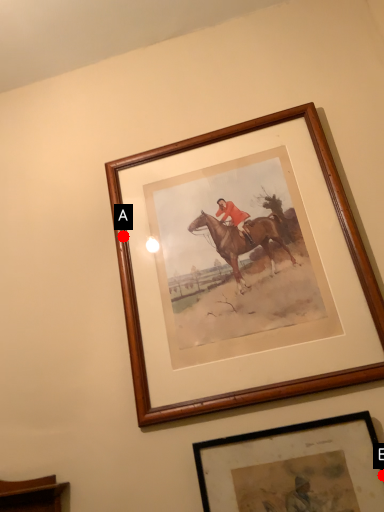
Question: Two points are circled on the image, labeled by A and B beside each circle. Which of the following is the farthest from the observer?

Choices:
 (A) A is further
 (B) B is further

Answer: (A)